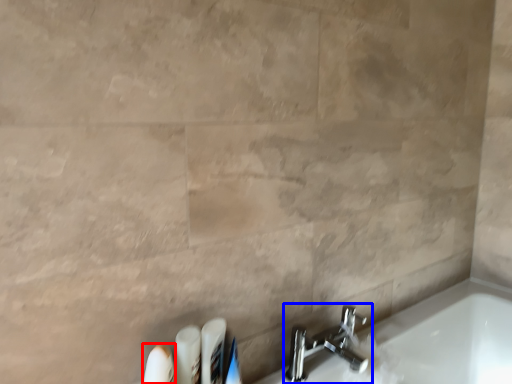
Question: Among these objects, which one is nearest to the camera, toiletry (highlighted by a red box) or tap (highlighted by a blue box)?

Choices:
 (A) toiletry
 (B) tap

Answer: (A)